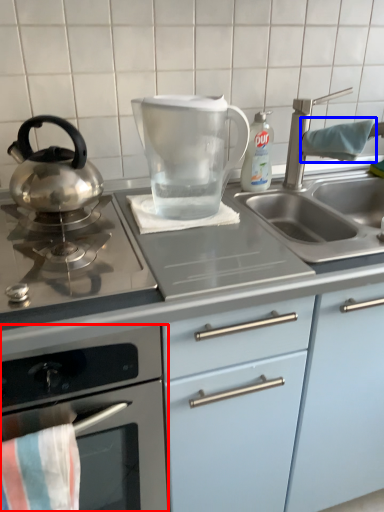
Question: Which object appears closest to the camera in this image, kitchen appliance (highlighted by a red box) or beach towel (highlighted by a blue box)?

Choices:
 (A) kitchen appliance
 (B) beach towel

Answer: (A)